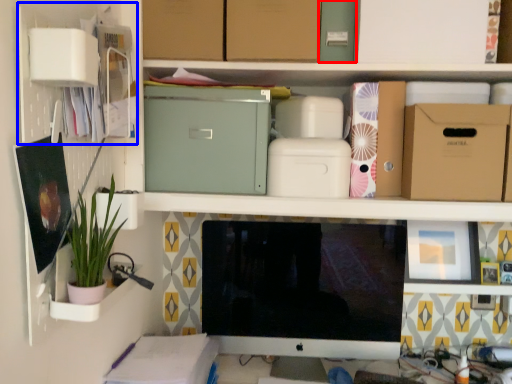
Question: Which object appears farthest to the camera in this image, storage box (highlighted by a red box) or cabinet (highlighted by a blue box)?

Choices:
 (A) storage box
 (B) cabinet

Answer: (A)